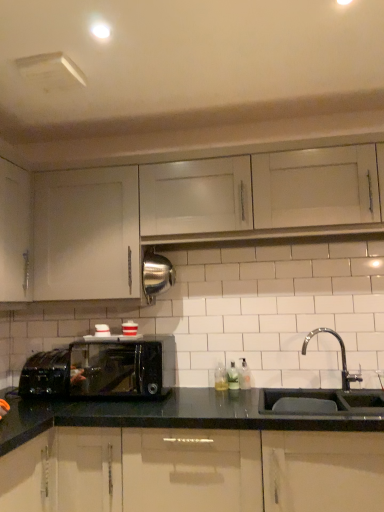
The width and height of the screenshot is (384, 512). I want to click on vacant area to the right of clear glass soap dispenser at sink right, which is counted as the third bottle, starting from the left, so click(x=270, y=390).